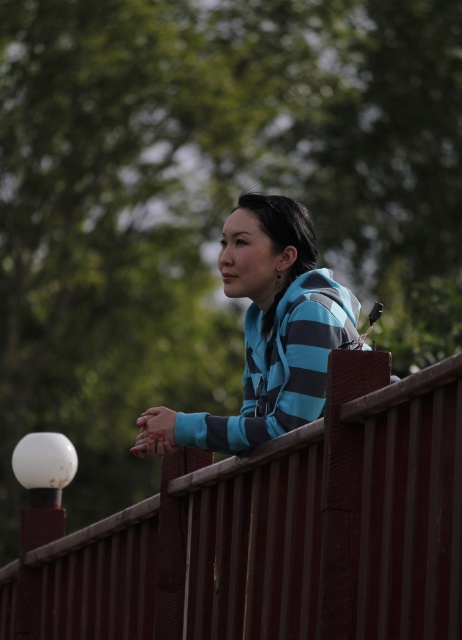
You are a photographer trying to capture a shot of the blue striped hoodie at center and the rustic wood fence at center. From your current position, which object would you need to pan your camera to the right to include in the frame?

Since the rustic wood fence at center is to the left of the blue striped hoodie at center, to include the rustic wood fence at center in the frame, you would need to pan your camera to the right. However, since both are at the center, panning might not be necessary. Wait, the description says the fence is to the left of the hoodie, so if the hoodie is at the center, the fence is slightly left of center. Therefore, if the camera is currently centered on the hoodie, panning to the right would move away from,

You are taking a photo of the person on the wooden railing and notice two points marked in the image. Which of the two points, point [329,509] or point [309,225], is closer to you?

Point [329,509] is closer to the viewer than point [309,225].

Based on the scene description, where is the rustic wood fence located? Please provide coordinates in the format of a point like point (279, 532).

The point (279, 532) indicates the location of the rustic wood fence at center.